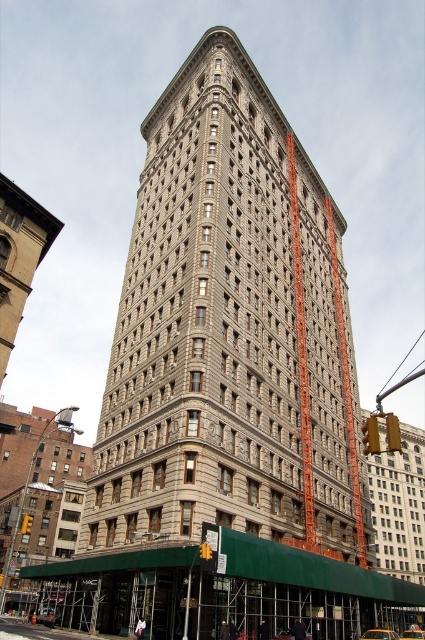
Can you confirm if brick building at lower left is positioned below matte gray building at lower right?

Indeed, brick building at lower left is positioned under matte gray building at lower right.

Does brick building at lower left appear over matte gray building at lower right?

No.

Which is behind, point (61, 481) or point (421, 536)?

Point (421, 536)

The image size is (425, 640). Identify the location of brick building at lower left. (39, 490).

The image size is (425, 640). Identify the location of matte gray building at lower right. (399, 504).

Is matte gray building at lower right closer to camera compared to beige stone building at lower left?

That is True.

The image size is (425, 640). What are the coordinates of `matte gray building at lower right` in the screenshot? It's located at [x=399, y=504].

Between brick building at lower left and beige stone building at lower left, which one has less height?

Standing shorter between the two is beige stone building at lower left.

Is brick building at lower left closer to camera compared to beige stone building at lower left?

No, brick building at lower left is behind beige stone building at lower left.

Locate an element on the screen. The width and height of the screenshot is (425, 640). brick building at lower left is located at coordinates (39, 490).

This screenshot has width=425, height=640. Identify the location of brick building at lower left. (39, 490).